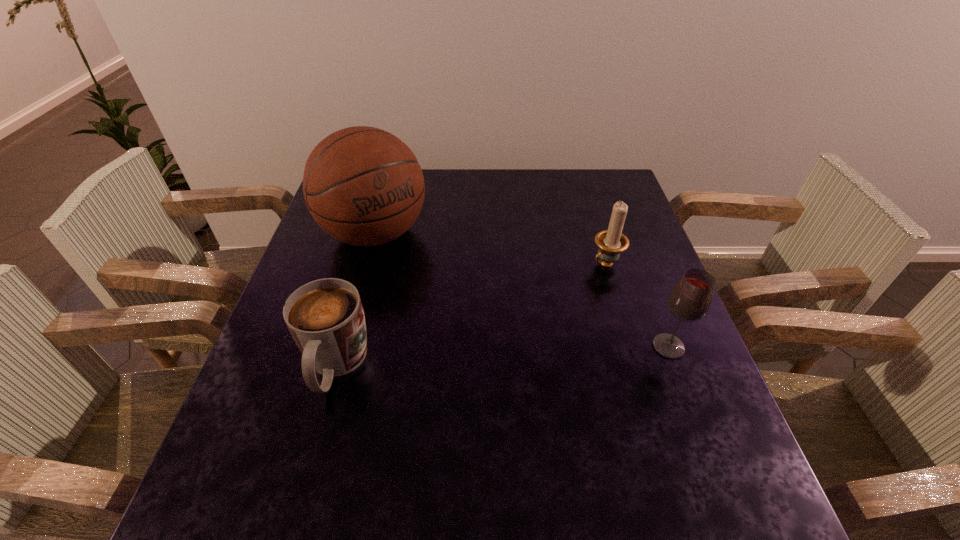
Find the location of a particular element. The height and width of the screenshot is (540, 960). free spot on the desktop that is between the shortest object and the rightmost object and is positioned on the handle side of the second object from right to left is located at coordinates (496, 356).

Where is `free space on the desktop that is between the shortest object and the rightmost object and is positioned on the side with brand label of the basketball`? The height and width of the screenshot is (540, 960). free space on the desktop that is between the shortest object and the rightmost object and is positioned on the side with brand label of the basketball is located at coordinates tap(480, 357).